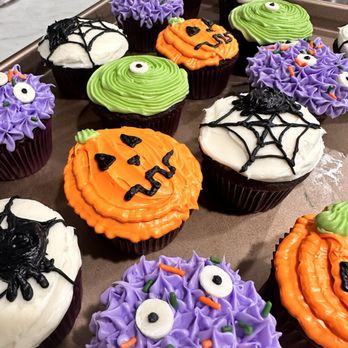
Where is `edge of baking pan`? The image size is (348, 348). edge of baking pan is located at coordinates (26, 55).